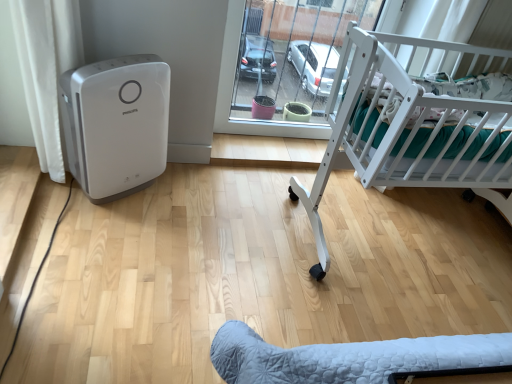
Question: Does transparent glass door at center have a larger size compared to white matte crib at right?

Choices:
 (A) yes
 (B) no

Answer: (B)

Question: Is the position of transparent glass door at center less distant than that of white matte crib at right?

Choices:
 (A) yes
 (B) no

Answer: (B)

Question: Considering the relative sizes of transparent glass door at center and white matte crib at right in the image provided, is transparent glass door at center thinner than white matte crib at right?

Choices:
 (A) yes
 (B) no

Answer: (A)

Question: From a real-world perspective, is transparent glass door at center physically below white matte crib at right?

Choices:
 (A) yes
 (B) no

Answer: (A)

Question: Does transparent glass door at center have a greater width compared to white matte crib at right?

Choices:
 (A) yes
 (B) no

Answer: (B)

Question: Is white plastic air purifier at left bigger or smaller than white matte crib at right?

Choices:
 (A) big
 (B) small

Answer: (B)

Question: From a real-world perspective, relative to white matte crib at right, is white plastic air purifier at left vertically above or below?

Choices:
 (A) below
 (B) above

Answer: (A)

Question: Considering the positions of white plastic air purifier at left and white matte crib at right in the image, is white plastic air purifier at left taller or shorter than white matte crib at right?

Choices:
 (A) short
 (B) tall

Answer: (B)

Question: Relative to white matte crib at right, is white plastic air purifier at left in front or behind?

Choices:
 (A) behind
 (B) front

Answer: (A)

Question: Is white plastic air purifier at left situated inside transparent glass door at center or outside?

Choices:
 (A) outside
 (B) inside

Answer: (A)

Question: From a real-world perspective, is white plastic air purifier at left physically located above or below transparent glass door at center?

Choices:
 (A) below
 (B) above

Answer: (A)

Question: Visually, is white plastic air purifier at left positioned to the left or to the right of transparent glass door at center?

Choices:
 (A) left
 (B) right

Answer: (A)

Question: From their relative heights in the image, would you say white plastic air purifier at left is taller or shorter than transparent glass door at center?

Choices:
 (A) short
 (B) tall

Answer: (A)

Question: Considering the positions of transparent glass door at center and white plastic air purifier at left in the image, is transparent glass door at center bigger or smaller than white plastic air purifier at left?

Choices:
 (A) small
 (B) big

Answer: (B)

Question: Is transparent glass door at center inside the boundaries of white plastic air purifier at left, or outside?

Choices:
 (A) outside
 (B) inside

Answer: (A)